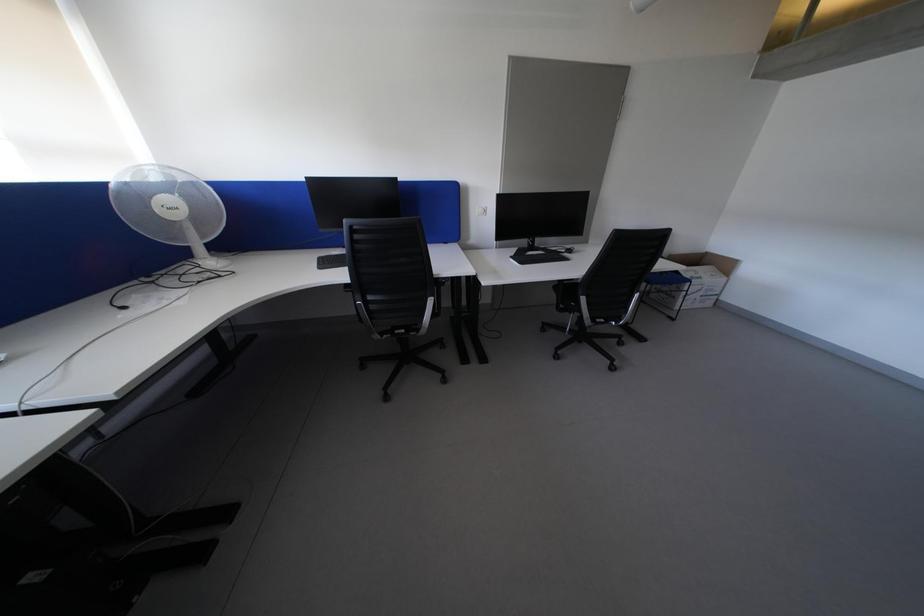
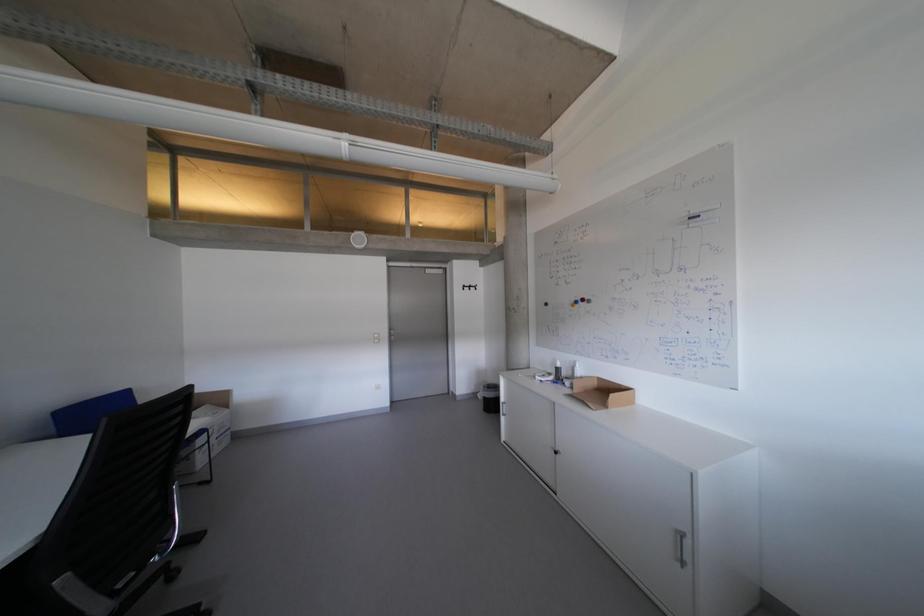
Question: How did the camera likely rotate?

Choices:
 (A) Left
 (B) Right
 (C) Up
 (D) Down

Answer: (B)